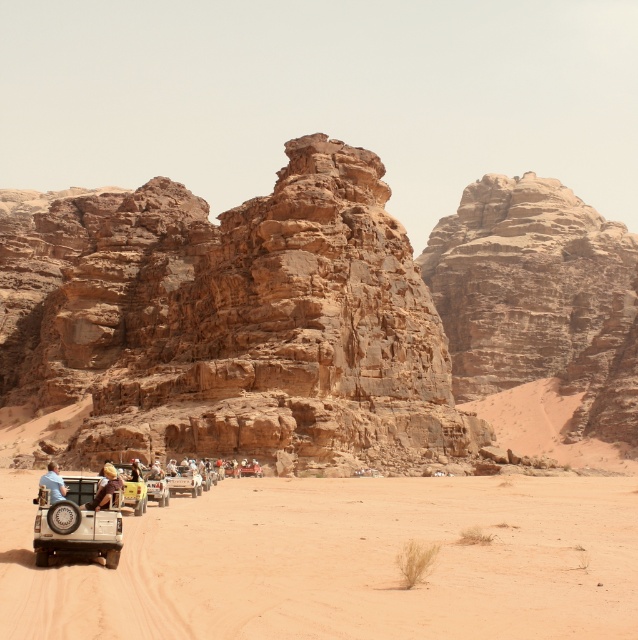
Looking at this image, which is above, brown sandy dirt track at lower left or matte beige jeep at lower left?

Positioned higher is matte beige jeep at lower left.

The height and width of the screenshot is (640, 638). Describe the element at coordinates (339, 561) in the screenshot. I see `brown sandy dirt track at lower left` at that location.

What are the coordinates of `brown sandy dirt track at lower left` in the screenshot? It's located at (339, 561).

Is point (323, 179) more distant than point (105, 502)?

Yes, it is.

Where is `rustic sandstone rock formation at center`? The image size is (638, 640). rustic sandstone rock formation at center is located at coordinates (315, 316).

Does rustic sandstone rock formation at center appear on the left side of matte beige jeep at lower left?

No, rustic sandstone rock formation at center is not to the left of matte beige jeep at lower left.

Is rustic sandstone rock formation at center closer to the viewer compared to matte beige jeep at lower left?

No, it is not.

Who is more forward, (170, 353) or (43, 557)?

Point (43, 557)

The image size is (638, 640). I want to click on rustic sandstone rock formation at center, so click(x=315, y=316).